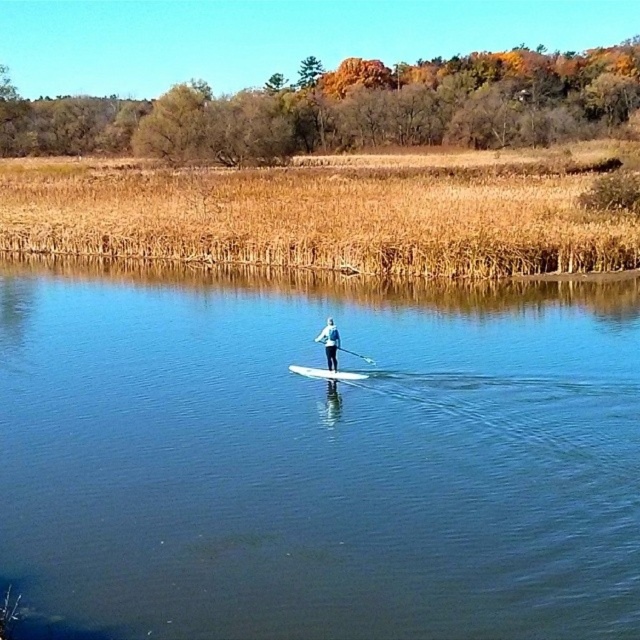
You are a photographer trying to capture the perfect shot of the white matte paddleboard at center and the white glossy paddle at center. From the shore, which object appears closer to the water surface?

The white glossy paddle at center appears closer to the water surface because the white matte paddleboard at center is located above it.

You are a photographer trying to capture the paddleboarder in the image. Since you want to ensure the paddleboarder is the main focus, which object should you avoid placing in the foreground to prevent blocking the view? Please choose between the dry grass at upper center and the white matte paddleboard at center.

The dry grass at upper center is taller than the white matte paddleboard at center, so to avoid blocking the paddleboarder, you should avoid placing the dry grass at upper center in the foreground.

You are planning to store the white matte paddleboard at center and the white glossy paddle at center in a storage compartment that is 1 meter wide. Can both items fit side by side without overlapping?

The white matte paddleboard at center is narrower than the white glossy paddle at center. However, since the total width of both items combined exceeds 1 meter, they cannot fit side by side in the storage compartment.